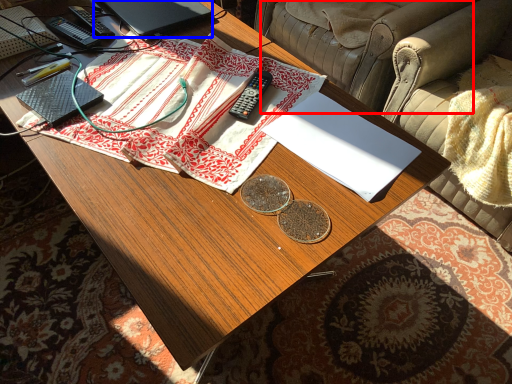
Question: Which object appears farthest to the camera in this image, armchair (highlighted by a red box) or laptop (highlighted by a blue box)?

Choices:
 (A) armchair
 (B) laptop

Answer: (A)